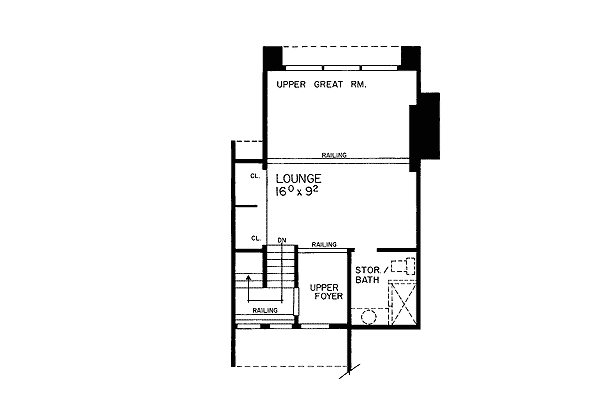
Help me find stor. / bath in the image by pointing to them. Your answer should be formatted as a list of tuples, i.e. [(x1, y1), (x2, y2), ...], where each tuple contains the x and y coordinates of a point satisfying the conditions above.

[(368, 269), (386, 268), (365, 282)]